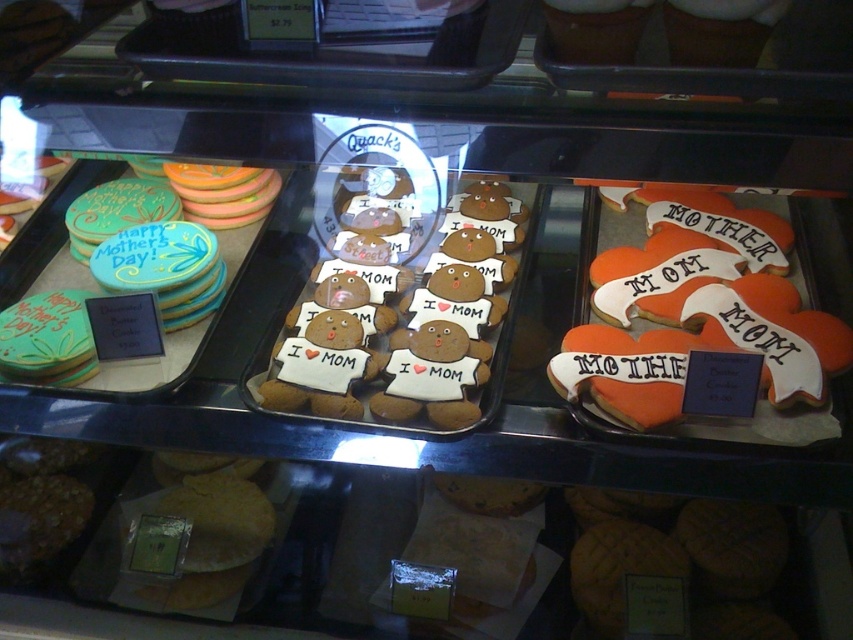
Question: Can you confirm if orange frosted heart-shaped cookies at center-right is smaller than matte green cookie at left?

Choices:
 (A) no
 (B) yes

Answer: (B)

Question: Which point is closer to the camera?

Choices:
 (A) (206, 317)
 (B) (752, 346)
 (C) (337, 355)

Answer: (B)

Question: Based on their relative distances, which object is farther from the matte green cookie at left?

Choices:
 (A) orange frosted heart-shaped cookies at center-right
 (B) brown sugar cookies at center

Answer: (A)

Question: Which of the following is the farthest from the observer?

Choices:
 (A) (492, 275)
 (B) (33, 384)

Answer: (A)

Question: In this image, where is orange frosted heart-shaped cookies at center-right located relative to matte green cookie at left?

Choices:
 (A) left
 (B) right

Answer: (B)

Question: Is orange frosted heart-shaped cookies at center-right thinner than matte green cookie at left?

Choices:
 (A) yes
 (B) no

Answer: (B)